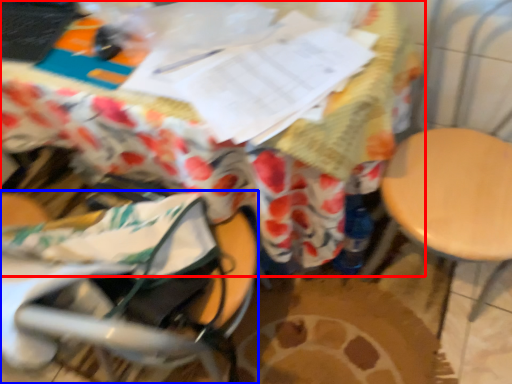
Question: Which point is closer to the camera, table (highlighted by a red box) or baby carriage (highlighted by a blue box)?

Choices:
 (A) table
 (B) baby carriage

Answer: (B)